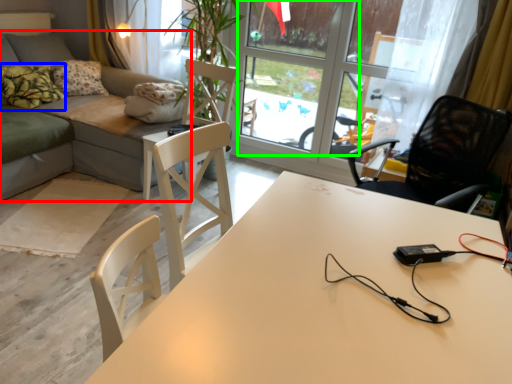
Question: Based on their relative distances, which object is nearer to studio couch (highlighted by a red box)? Choose from pillow (highlighted by a blue box) and window screen (highlighted by a green box).

Choices:
 (A) pillow
 (B) window screen

Answer: (A)